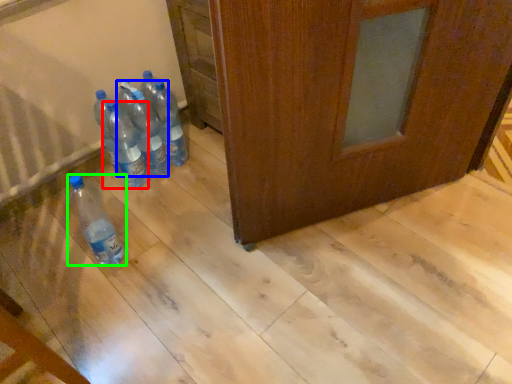
Question: Based on their relative distances, which object is farther from bottle (highlighted by a red box)? Choose from bottle (highlighted by a blue box) and bottle (highlighted by a green box).

Choices:
 (A) bottle
 (B) bottle

Answer: (B)